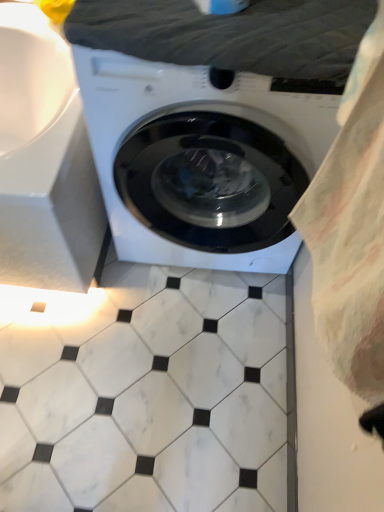
Question: Is dark gray fabric at upper center thinner than white glossy washing machine at center?

Choices:
 (A) yes
 (B) no

Answer: (A)

Question: Does dark gray fabric at upper center have a lesser height compared to white glossy washing machine at center?

Choices:
 (A) yes
 (B) no

Answer: (A)

Question: Is dark gray fabric at upper center next to white glossy washing machine at center and touching it?

Choices:
 (A) yes
 (B) no

Answer: (B)

Question: Can you confirm if dark gray fabric at upper center is bigger than white glossy washing machine at center?

Choices:
 (A) yes
 (B) no

Answer: (B)

Question: Considering the relative sizes of dark gray fabric at upper center and white glossy washing machine at center in the image provided, is dark gray fabric at upper center taller than white glossy washing machine at center?

Choices:
 (A) yes
 (B) no

Answer: (B)

Question: From a real-world perspective, is dark gray fabric at upper center below white glossy washing machine at center?

Choices:
 (A) yes
 (B) no

Answer: (B)

Question: Can you confirm if white glossy washing machine at center is thinner than dark gray fabric at upper center?

Choices:
 (A) no
 (B) yes

Answer: (A)

Question: Could you tell me if white glossy washing machine at center is turned towards dark gray fabric at upper center?

Choices:
 (A) no
 (B) yes

Answer: (A)

Question: Is white glossy washing machine at center positioned before dark gray fabric at upper center?

Choices:
 (A) no
 (B) yes

Answer: (B)

Question: Does white glossy washing machine at center have a smaller size compared to dark gray fabric at upper center?

Choices:
 (A) no
 (B) yes

Answer: (A)

Question: From the image's perspective, would you say white glossy washing machine at center is shown under dark gray fabric at upper center?

Choices:
 (A) no
 (B) yes

Answer: (B)

Question: Does white glossy washing machine at center have a lesser height compared to dark gray fabric at upper center?

Choices:
 (A) yes
 (B) no

Answer: (B)

Question: From the image's perspective, relative to dark gray fabric at upper center, is white glossy washing machine at center above or below?

Choices:
 (A) above
 (B) below

Answer: (B)